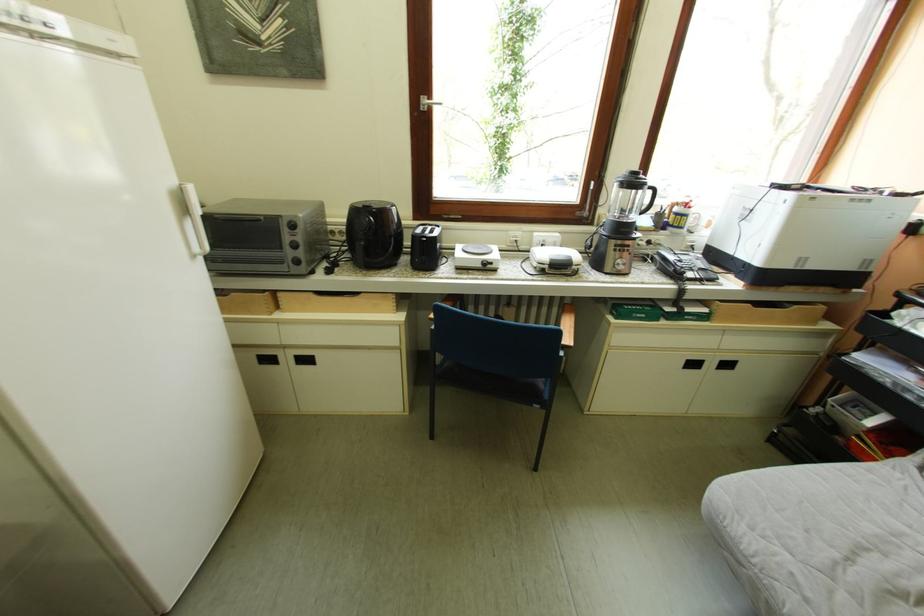
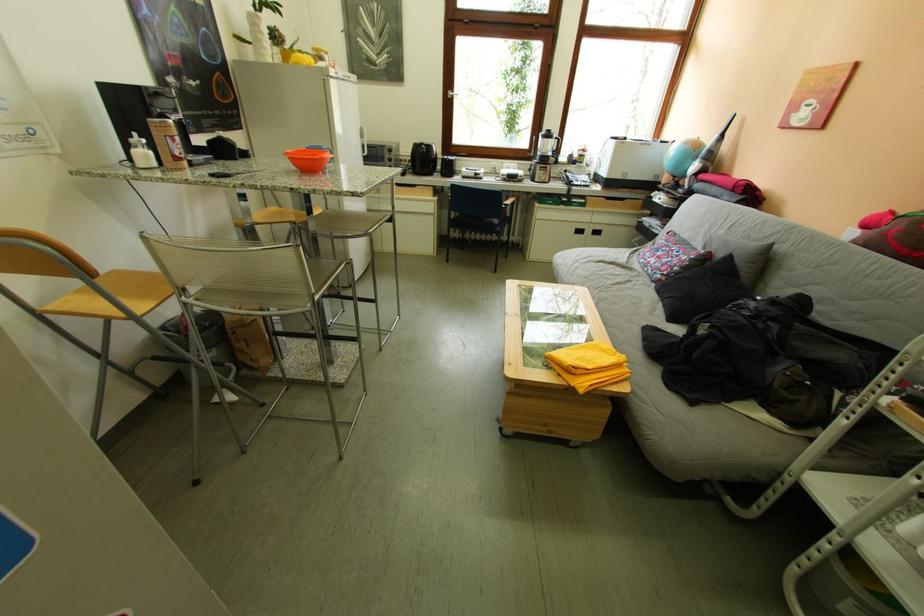
Locate, in the second image, the point that corresponds to (x=590, y=217) in the first image.

(541, 156)